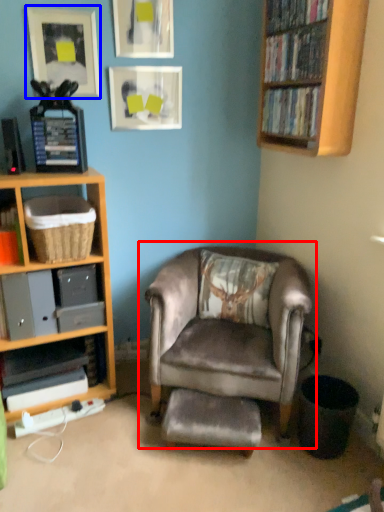
Question: Which of the following is the closest to the observer, chair (highlighted by a red box) or picture frame (highlighted by a blue box)?

Choices:
 (A) chair
 (B) picture frame

Answer: (A)